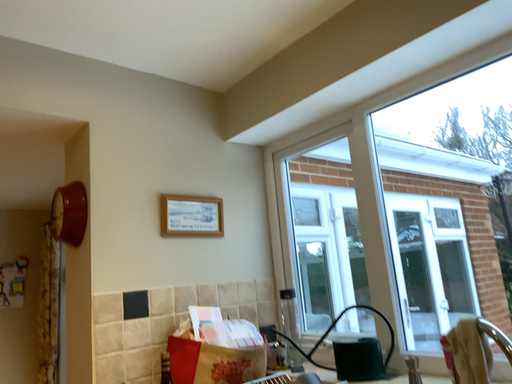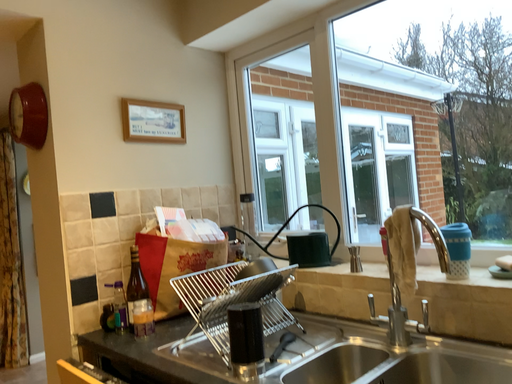
Question: How did the camera likely rotate when shooting the video?

Choices:
 (A) rotated downward
 (B) rotated upward

Answer: (A)